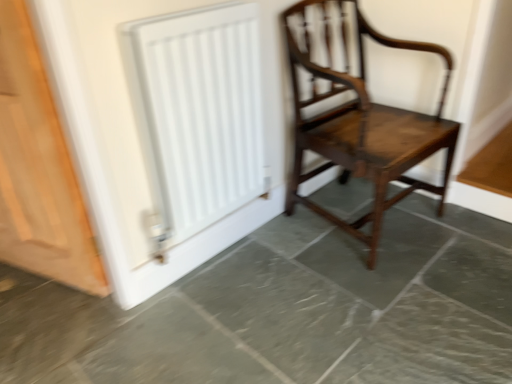
Question: Should I look upward or downward to see white matte radiator at upper left?

Choices:
 (A) up
 (B) down

Answer: (A)

Question: Is gray marble floor at center to the left of white matte radiator at upper left from the viewer's perspective?

Choices:
 (A) yes
 (B) no

Answer: (B)

Question: Considering the relative positions of gray marble floor at center and white matte radiator at upper left in the image provided, is gray marble floor at center in front of white matte radiator at upper left?

Choices:
 (A) no
 (B) yes

Answer: (B)

Question: Is gray marble floor at center positioned beyond the bounds of white matte radiator at upper left?

Choices:
 (A) yes
 (B) no

Answer: (A)

Question: From a real-world perspective, is gray marble floor at center positioned over white matte radiator at upper left based on gravity?

Choices:
 (A) no
 (B) yes

Answer: (A)

Question: Is gray marble floor at center bigger than white matte radiator at upper left?

Choices:
 (A) no
 (B) yes

Answer: (B)

Question: Would you say gray marble floor at center contains white matte radiator at upper left?

Choices:
 (A) no
 (B) yes

Answer: (A)

Question: Is gray marble floor at center surrounding light brown wood door at left?

Choices:
 (A) no
 (B) yes

Answer: (A)

Question: Does gray marble floor at center touch light brown wood door at left?

Choices:
 (A) yes
 (B) no

Answer: (B)

Question: Can you confirm if gray marble floor at center is thinner than light brown wood door at left?

Choices:
 (A) no
 (B) yes

Answer: (A)

Question: Considering the relative positions of gray marble floor at center and light brown wood door at left in the image provided, is gray marble floor at center to the left of light brown wood door at left from the viewer's perspective?

Choices:
 (A) no
 (B) yes

Answer: (A)

Question: From a real-world perspective, is gray marble floor at center on light brown wood door at left?

Choices:
 (A) yes
 (B) no

Answer: (B)

Question: Does gray marble floor at center appear on the right side of light brown wood door at left?

Choices:
 (A) no
 (B) yes

Answer: (B)

Question: Can you confirm if white matte radiator at upper left is wider than mahogany wooden chair at center?

Choices:
 (A) yes
 (B) no

Answer: (B)